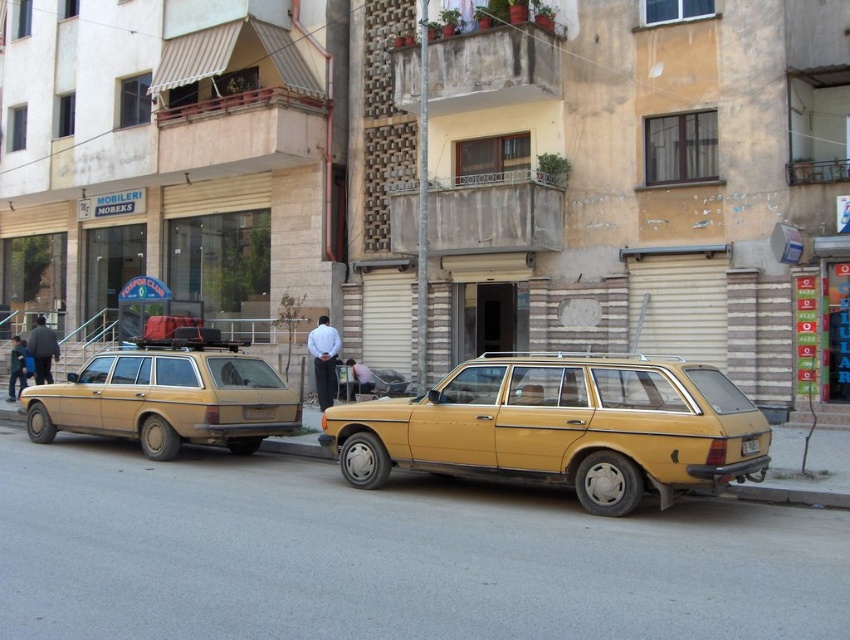
You are a delivery driver who needs to park your van between the two yellow matte license plates. The van is 2 meters long. Can you fit your van between the two yellow matte license plate at center and yellow matte license plate at rear?

The yellow matte license plate at center is to the left of the yellow matte license plate at rear, but the distance between them is not provided. Therefore, it is impossible to determine if the van can fit based on the given information.